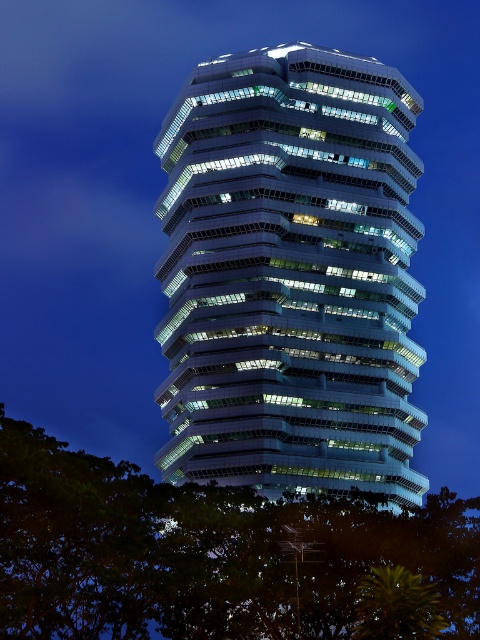
Looking at this image, does white glass tower at center have a greater height compared to green leafy tree at lower left?

Yes.

Is white glass tower at center thinner than green leafy tree at lower left?

Yes, white glass tower at center is thinner than green leafy tree at lower left.

Describe the element at coordinates (290, 275) in the screenshot. I see `white glass tower at center` at that location.

At what (x,y) coordinates should I click in order to perform the action: click on white glass tower at center. Please return your answer as a coordinate pair (x, y). This screenshot has height=640, width=480. Looking at the image, I should click on (290, 275).